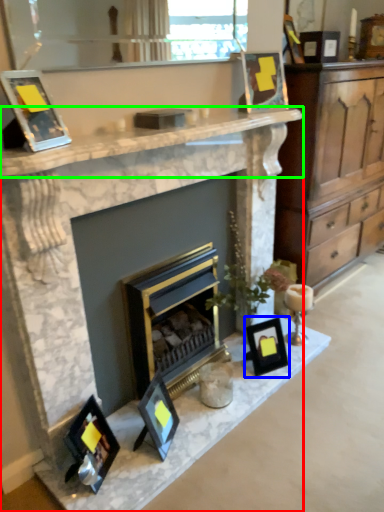
Question: Which object is the farthest from fireplace (highlighted by a red box)? Choose among these: picture frame (highlighted by a blue box) or counter top (highlighted by a green box).

Choices:
 (A) picture frame
 (B) counter top

Answer: (A)